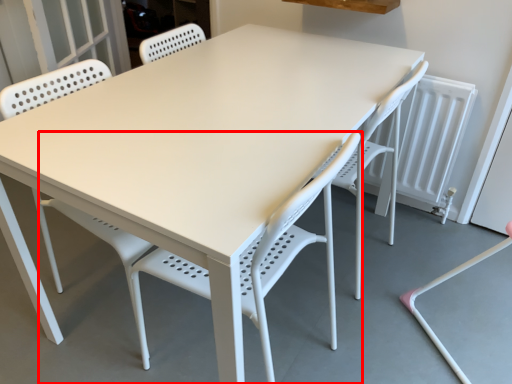
Question: From the image's perspective, what is the correct spatial relationship of chair (annotated by the red box) in relation to swivel chair?

Choices:
 (A) above
 (B) below

Answer: (B)